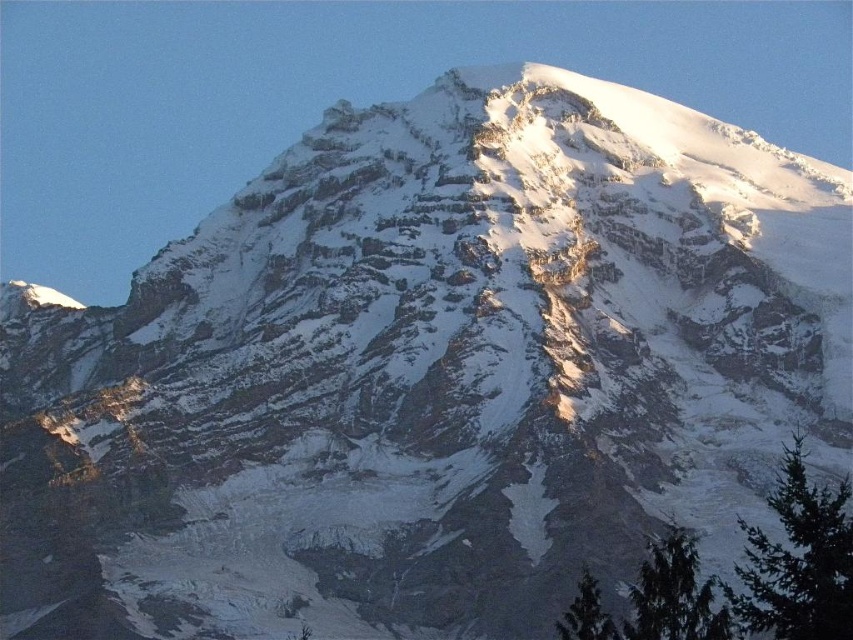
In the scene shown: You are a hiker planning to take a photo of the majestic mountain peak. You have two trees in your viewfinder, the green matte tree at lower right and the green textured tree at lower right. Which tree should you use as a foreground element if you want the larger tree to frame the mountain?

You should use the green matte tree at lower right as the foreground element because it is bigger than the green textured tree at lower right.

You are a hiker standing in front of the mountain and see the green textured evergreen at lower right and the green matte tree at lower right. Which tree is more to the right?

The green textured evergreen at lower right is more to the right since it is positioned on the right side of the green matte tree at lower right.